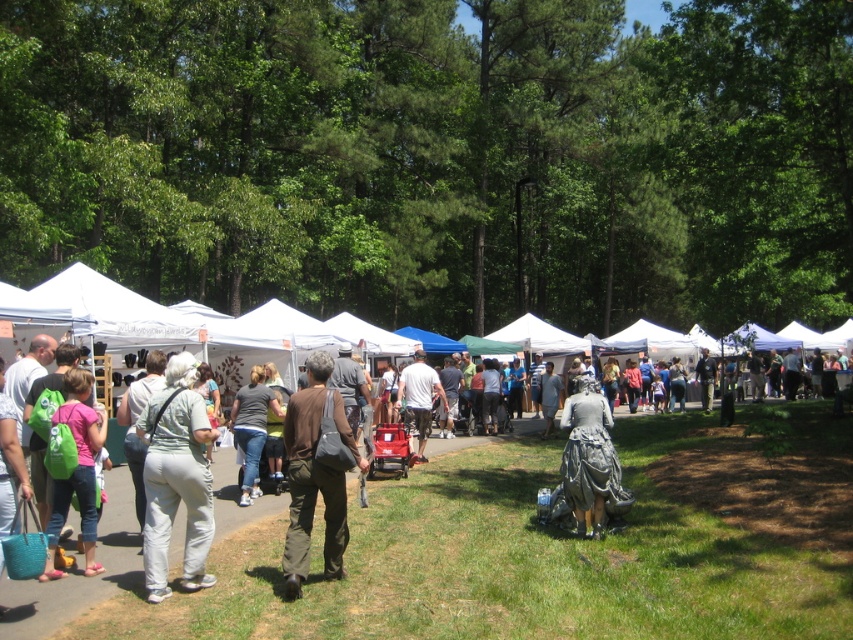
Who is higher up, white fabric tent at left or light gray pants at center?

light gray pants at center

Identify the location of white fabric tent at left. (560, 547).

This screenshot has width=853, height=640. In order to click on white fabric tent at left in this screenshot , I will do `click(560, 547)`.

Between green fabric backpack at lower left and matte gray lawn mower at center, which one appears on the right side from the viewer's perspective?

Positioned to the right is matte gray lawn mower at center.

Which is in front, point (84, 538) or point (428, 392)?

Positioned in front is point (84, 538).

Is point (83, 541) farther from camera compared to point (421, 424)?

That is False.

Locate an element on the screen. This screenshot has height=640, width=853. green fabric backpack at lower left is located at coordinates (76, 470).

Locate an element on the screen. white fabric tent at left is located at coordinates (560, 547).

Does point (242, 609) come closer to viewer compared to point (244, 486)?

That is True.

Who is more forward, (78, 634) or (239, 396)?

Point (78, 634) is in front.

At what (x,y) coordinates should I click in order to perform the action: click on white fabric tent at left. Please return your answer as a coordinate pair (x, y). The image size is (853, 640). Looking at the image, I should click on 560,547.